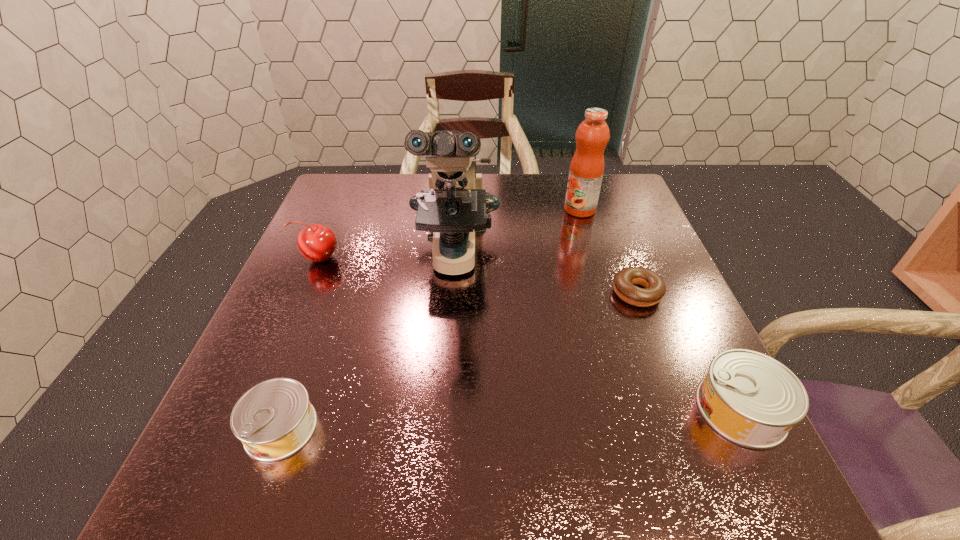
Where is `free space between the right can and the shorter can`? free space between the right can and the shorter can is located at coordinates (511, 418).

Where is `free spot between the left can and the doughnut`? This screenshot has height=540, width=960. free spot between the left can and the doughnut is located at coordinates (459, 360).

Where is `free spot between the left can and the right can`? The height and width of the screenshot is (540, 960). free spot between the left can and the right can is located at coordinates (511, 418).

Where is `vacant space that is in between the fourth tallest object and the shortest object`? The height and width of the screenshot is (540, 960). vacant space that is in between the fourth tallest object and the shortest object is located at coordinates coord(689,351).

At what (x,y) coordinates should I click in order to perform the action: click on object that is the fourth nearest to the doughnut. Please return your answer as a coordinate pair (x, y). This screenshot has width=960, height=540. Looking at the image, I should click on (274, 419).

Locate which object ranks fourth in proximity to the cherry. Please provide its 2D coordinates. Your answer should be formatted as a tuple, i.e. [(x, y)], where the tuple contains the x and y coordinates of a point satisfying the conditions above.

[(654, 289)]

Image resolution: width=960 pixels, height=540 pixels. What are the coordinates of `free space that satisfies the following two spatial constraints: 1. through the eyepieces of the microscope; 2. on the right side of the fourth tallest object` in the screenshot? It's located at (444, 409).

You are a GUI agent. You are given a task and a screenshot of the screen. Output one action in this format:
    pyautogui.click(x=<x>, y=<y>)
    Task: Click on the free spot that satisfies the following two spatial constraints: 1. on the front label of the second tallest object; 2. on the left side of the shortest object
    Image resolution: width=960 pixels, height=540 pixels.
    Given the screenshot: What is the action you would take?
    pyautogui.click(x=605, y=293)

You are a GUI agent. You are given a task and a screenshot of the screen. Output one action in this format:
    pyautogui.click(x=<x>, y=<y>)
    Task: Click on the free location that satisfies the following two spatial constraints: 1. on the front label of the fruit juice; 2. through the eyepieces of the tallest object
    The height and width of the screenshot is (540, 960).
    Given the screenshot: What is the action you would take?
    pos(594,256)

Identify the location of free space that satisfies the following two spatial constraints: 1. on the front label of the fruit juice; 2. on the front side of the left can. The image size is (960, 540). (646, 428).